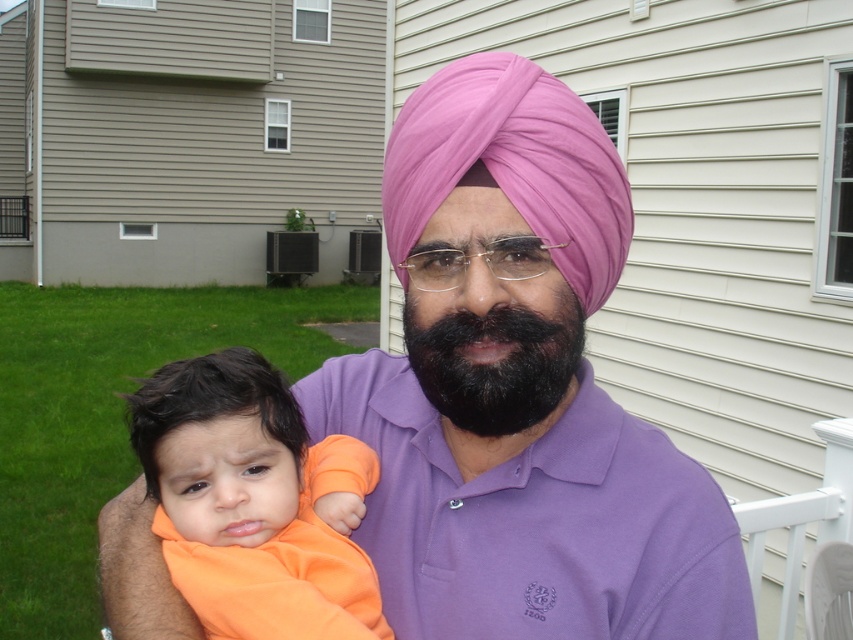
Measure the distance from orange fleece at center to pink fabric turban at center.

orange fleece at center and pink fabric turban at center are 13.57 inches apart.

Is the position of orange fleece at center more distant than that of pink fabric turban at center?

Yes, orange fleece at center is further from the viewer.

This screenshot has height=640, width=853. I want to click on orange fleece at center, so click(254, 500).

Between point (602, 202) and point (236, 412), which one is positioned in front?

Point (602, 202)

Is purple matte turban at center shorter than orange fleece at center?

In fact, purple matte turban at center may be taller than orange fleece at center.

Find the location of a particular element. purple matte turban at center is located at coordinates (518, 388).

You are a GUI agent. You are given a task and a screenshot of the screen. Output one action in this format:
    pyautogui.click(x=<x>, y=<y>)
    Task: Click on the purple matte turban at center
    
    Given the screenshot: What is the action you would take?
    pyautogui.click(x=518, y=388)

Between point (489, 518) and point (190, 410), which one is positioned behind?

The point (489, 518) is behind.

Between point (573, 595) and point (370, 484), which one is positioned in front?

Positioned in front is point (573, 595).

Find the location of a particular element. Image resolution: width=853 pixels, height=640 pixels. purple cotton polo shirt at center is located at coordinates (534, 520).